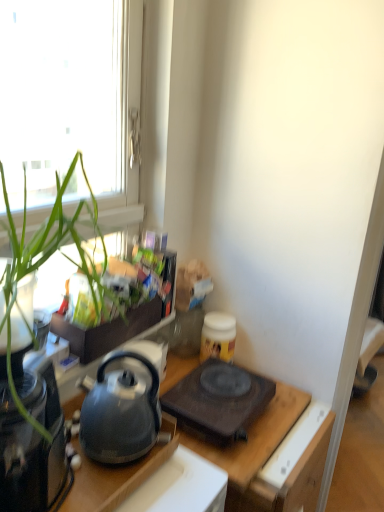
Find the location of a particular element. This screenshot has width=384, height=512. empty space that is ontop of black matte gas stove at center is located at coordinates (220, 383).